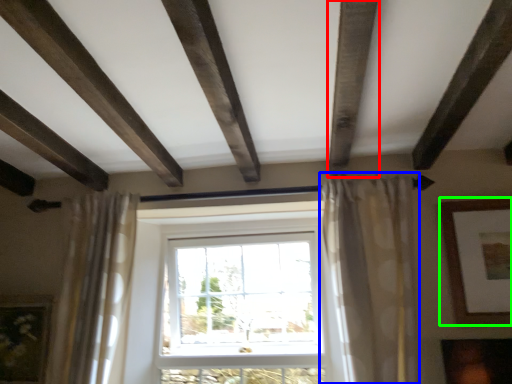
Question: Estimate the real-world distances between objects in this image. Which object is farther from plank (highlighted by a red box), curtain (highlighted by a blue box) or picture frame (highlighted by a green box)?

Choices:
 (A) curtain
 (B) picture frame

Answer: (B)